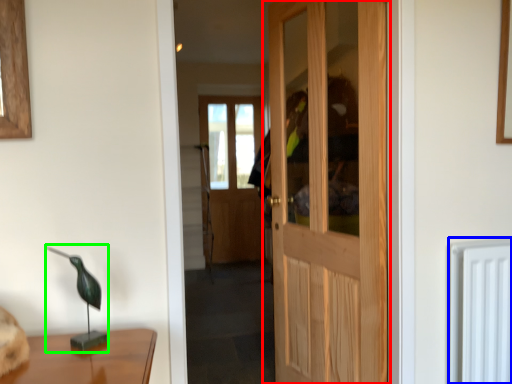
Question: Which object is the closest to the door (highlighted by a red box)? Choose among these: radiator (highlighted by a blue box) or table lamp (highlighted by a green box).

Choices:
 (A) radiator
 (B) table lamp

Answer: (A)